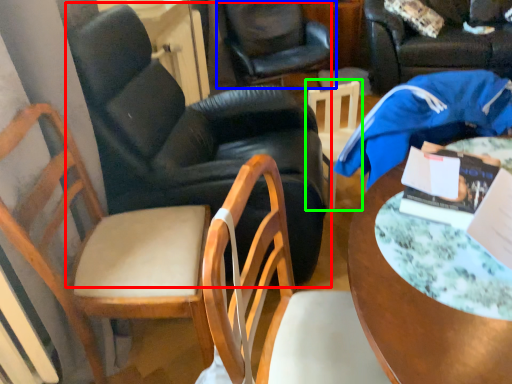
Question: Which is farther away from chair (highlighted by a red box)? chair (highlighted by a blue box) or chair (highlighted by a green box)?

Choices:
 (A) chair
 (B) chair

Answer: (A)